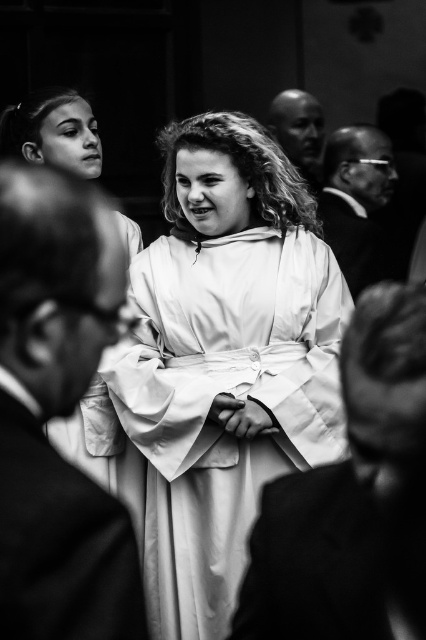
Question: Which of the following is the closest to the observer?

Choices:
 (A) (359, 189)
 (B) (287, 88)
 (C) (236, 532)
 (D) (357, 556)

Answer: (D)

Question: Which object is closer to the camera taking this photo?

Choices:
 (A) smooth black glasses at right
 (B) smooth bald head at upper center
 (C) white smooth robe at center
 (D) smooth white robe at center

Answer: (D)

Question: Does white smooth robe at center have a lesser width compared to smooth black glasses at right?

Choices:
 (A) yes
 (B) no

Answer: (B)

Question: Does white smooth robe at center have a smaller size compared to smooth white robe at center?

Choices:
 (A) yes
 (B) no

Answer: (B)

Question: Is white smooth robe at center above smooth black glasses at right?

Choices:
 (A) yes
 (B) no

Answer: (B)

Question: Which point appears closest to the camera in this image?

Choices:
 (A) (106, 570)
 (B) (337, 182)

Answer: (A)